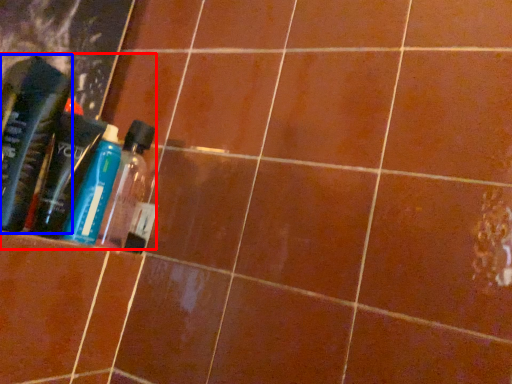
Question: Which object appears farthest to the camera in this image, product (highlighted by a red box) or bottle (highlighted by a blue box)?

Choices:
 (A) product
 (B) bottle

Answer: (A)